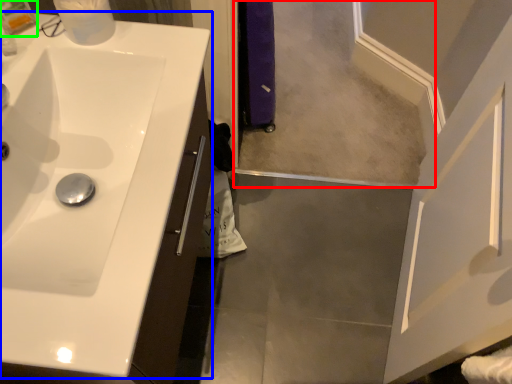
Question: Estimate the real-world distances between objects in this image. Which object is closer to mirror (highlighted by a red box), sink (highlighted by a blue box) or toiletry (highlighted by a green box)?

Choices:
 (A) sink
 (B) toiletry

Answer: (A)